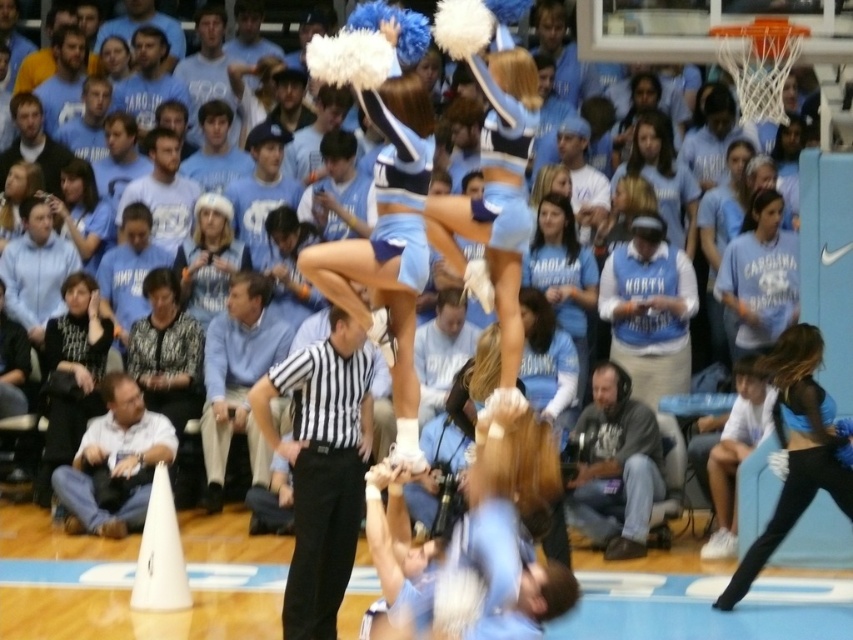
You are a photographer trying to capture the cheerleaders in the scene. You want to ensure that the black matte cheerleader at right and the light blue fabric at center are both in focus. Given their sizes, which object should you adjust your camera settings to prioritize focusing on first?

The black matte cheerleader at right has a larger width than the light blue fabric at center, so you should prioritize focusing on the black matte cheerleader at right first since it occupies more space in the frame.

You are a photographer trying to capture the cheerleaders in the image. You notice the black striped shirt at center and the light brown hair at upper left. Which object should you focus on to ensure it fits entirely within your camera frame if the frame can only accommodate the wider of the two?

The black striped shirt at center has a larger width than the light brown hair at upper left, so focusing on the black striped shirt at center ensures it fits within the camera frame.

You are a photographer at the basketball game and want to capture both the black striped shirt at center and the light brown hair at upper left in a single shot. Given their sizes, which object should you focus on to ensure both are clearly visible in the frame?

The black striped shirt at center is larger in size than the light brown hair at upper left, so focusing on the black striped shirt at center would help ensure both are clearly visible since it takes up more space in the frame.